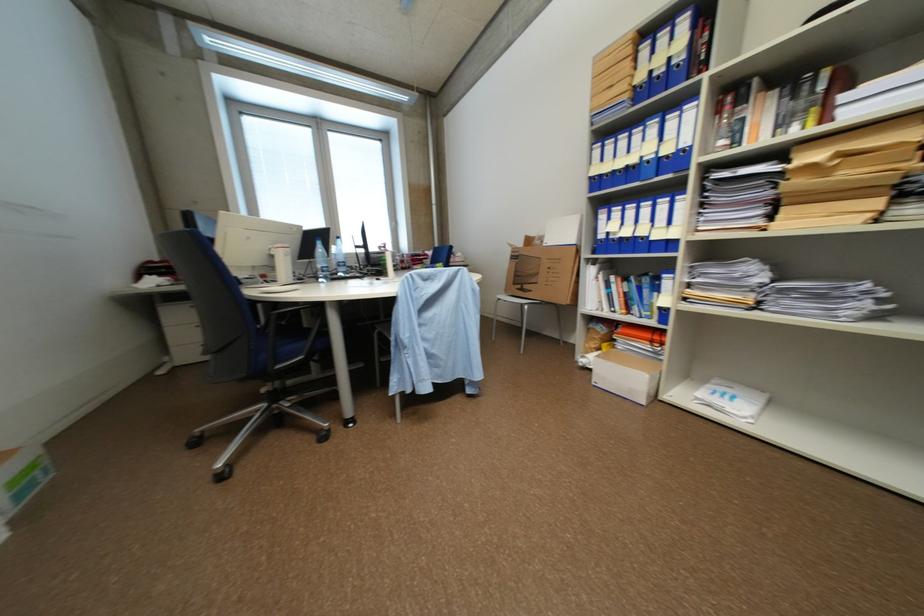
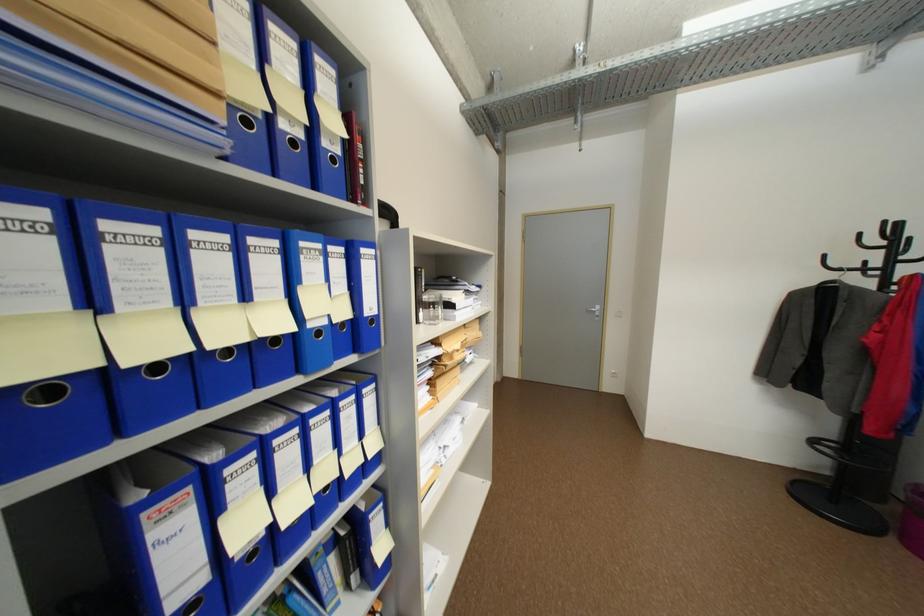
Where in the second image is the point corresponding to point 615,176 from the first image?

(164, 368)